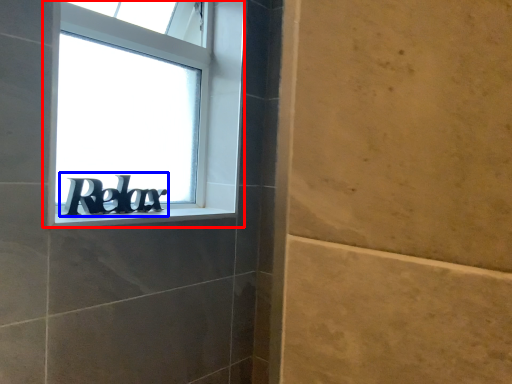
Question: Which object is further to the camera taking this photo, window (highlighted by a red box) or number (highlighted by a blue box)?

Choices:
 (A) window
 (B) number

Answer: (B)